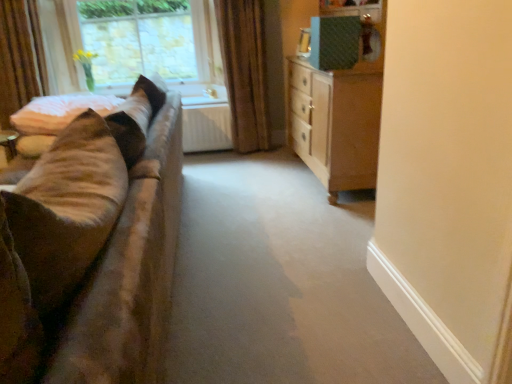
Where is `velvet brown couch at left`? velvet brown couch at left is located at coordinates (93, 248).

Locate an element on the screen. This screenshot has width=512, height=384. velvet brown couch at left is located at coordinates (93, 248).

How different are the orientations of velvet brown couch at left and clear glass window at upper left in degrees?

91.1 degrees.

Looking at this image, is clear glass window at upper left a part of velvet brown couch at left?

No, clear glass window at upper left is not surrounded by velvet brown couch at left.

Relative to clear glass window at upper left, is velvet brown couch at left in front or behind?

Clearly, velvet brown couch at left is in front of clear glass window at upper left.

From the image's perspective, which is below, wooden chest of drawers at right or soft beige fabric at left?

soft beige fabric at left, from the image's perspective.

Who is taller, wooden chest of drawers at right or soft beige fabric at left?

With more height is wooden chest of drawers at right.

Is wooden chest of drawers at right oriented towards soft beige fabric at left?

Yes, wooden chest of drawers at right is oriented towards soft beige fabric at left.

Considering the positions of objects wooden chest of drawers at right and clear glass window at upper left in the image provided, who is more to the left, wooden chest of drawers at right or clear glass window at upper left?

clear glass window at upper left.

Between wooden chest of drawers at right and clear glass window at upper left, which one has smaller size?

With smaller size is clear glass window at upper left.

Find the location of `window behind the wooden chest of drawers at right`. window behind the wooden chest of drawers at right is located at coordinates click(144, 43).

In the scene shown: From the image's perspective, is wooden chest of drawers at right over clear glass window at upper left?

Actually, wooden chest of drawers at right appears below clear glass window at upper left in the image.

Does velvet brown couch at left have a lesser width compared to soft beige fabric at left?

In fact, velvet brown couch at left might be wider than soft beige fabric at left.

Visually, is velvet brown couch at left positioned to the left or to the right of soft beige fabric at left?

From the image, it's evident that velvet brown couch at left is to the right of soft beige fabric at left.

From a real-world perspective, who is located higher, velvet brown couch at left or soft beige fabric at left?

From a 3D spatial view, soft beige fabric at left is above.

In order to click on bedding that is on the left side of wooden chest of drawers at right in this screenshot , I will do `click(59, 112)`.

Does soft beige fabric at left have a smaller size compared to wooden chest of drawers at right?

Indeed, soft beige fabric at left has a smaller size compared to wooden chest of drawers at right.

Can you confirm if soft beige fabric at left is thinner than wooden chest of drawers at right?

In fact, soft beige fabric at left might be wider than wooden chest of drawers at right.

Between soft beige fabric at left and wooden chest of drawers at right, which one appears on the right side from the viewer's perspective?

wooden chest of drawers at right is more to the right.

Is brown fabric curtain at upper center positioned with its back to wooden chest of drawers at right?

No, wooden chest of drawers at right is not at the back of brown fabric curtain at upper center.

Can you confirm if brown fabric curtain at upper center is shorter than wooden chest of drawers at right?

No, brown fabric curtain at upper center is not shorter than wooden chest of drawers at right.

How many degrees apart are the facing directions of brown fabric curtain at upper center and wooden chest of drawers at right?

The facing directions of brown fabric curtain at upper center and wooden chest of drawers at right are 85.9 degrees apart.

Is the depth of brown fabric curtain at upper center greater than that of wooden chest of drawers at right?

Yes, brown fabric curtain at upper center is further from the viewer.

From a real-world perspective, which is physically below, velvet brown couch at left or brown fabric curtain at upper center?

From a 3D spatial view, velvet brown couch at left is below.

The height and width of the screenshot is (384, 512). I want to click on studio couch located underneath the brown fabric curtain at upper center (from a real-world perspective), so click(x=93, y=248).

Is velvet brown couch at left oriented towards brown fabric curtain at upper center?

No, velvet brown couch at left is not facing towards brown fabric curtain at upper center.

Is velvet brown couch at left not inside brown fabric curtain at upper center?

Yes.

Locate an element on the screen. window that appears above the velvet brown couch at left (from the image's perspective) is located at coordinates tap(144, 43).

The width and height of the screenshot is (512, 384). I want to click on bedding below the wooden chest of drawers at right (from the image's perspective), so click(x=59, y=112).

Estimate the real-world distances between objects in this image. Which object is closer to velvet brown couch at left, soft beige fabric at left or wooden chest of drawers at right?

soft beige fabric at left is positioned closer to the anchor velvet brown couch at left.

From the image, which object appears to be farther from wooden chest of drawers at right, soft beige fabric at left or velvet brown couch at left?

soft beige fabric at left is further to wooden chest of drawers at right.

When comparing their distances from velvet brown couch at left, does wooden chest of drawers at right or clear glass window at upper left seem closer?

Among the two, wooden chest of drawers at right is located nearer to velvet brown couch at left.

Looking at the image, which one is located further to soft beige fabric at left, brown fabric curtain at upper center or clear glass window at upper left?

The object further to soft beige fabric at left is clear glass window at upper left.

Which object lies further to the anchor point wooden chest of drawers at right, velvet brown couch at left or brown fabric curtain at upper center?

velvet brown couch at left.

Which object lies further to the anchor point brown fabric curtain at upper center, clear glass window at upper left or wooden chest of drawers at right?

wooden chest of drawers at right is further to brown fabric curtain at upper center.

Which object lies nearer to the anchor point clear glass window at upper left, soft beige fabric at left or velvet brown couch at left?

soft beige fabric at left.

In the scene shown: Considering their positions, is velvet brown couch at left positioned further to wooden chest of drawers at right than clear glass window at upper left?

Based on the image, clear glass window at upper left appears to be further to wooden chest of drawers at right.

The height and width of the screenshot is (384, 512). In order to click on curtain between velvet brown couch at left and clear glass window at upper left from front to back in this screenshot , I will do `click(250, 70)`.

Find the location of a particular element. The image size is (512, 384). chest of drawers between velvet brown couch at left and brown fabric curtain at upper center in the front-back direction is located at coordinates (335, 125).

Image resolution: width=512 pixels, height=384 pixels. Find the location of `chest of drawers between velvet brown couch at left and clear glass window at upper left along the z-axis`. chest of drawers between velvet brown couch at left and clear glass window at upper left along the z-axis is located at coordinates (335, 125).

Locate an element on the screen. The image size is (512, 384). bedding between velvet brown couch at left and brown fabric curtain at upper center in the front-back direction is located at coordinates tap(59, 112).